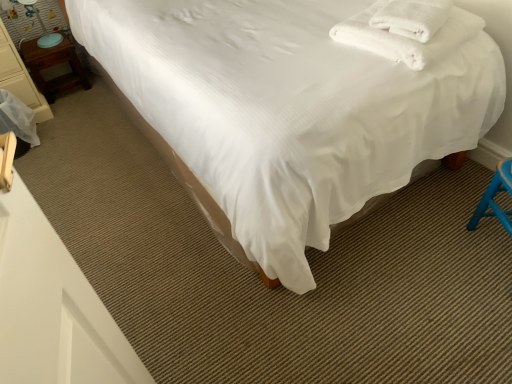
I want to click on free space to the right of wooden nightstand at left, so click(x=79, y=106).